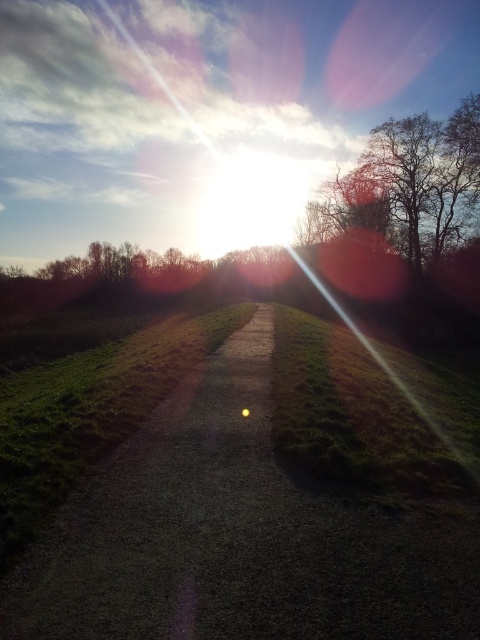
Does point (386, 602) come behind point (385, 186)?

That is False.

In order to click on gravel path at center in this screenshot , I will do click(238, 536).

Does point (96, 602) come in front of point (454, 152)?

That is True.

Where is `gravel path at center`? Image resolution: width=480 pixels, height=640 pixels. gravel path at center is located at coordinates (238, 536).